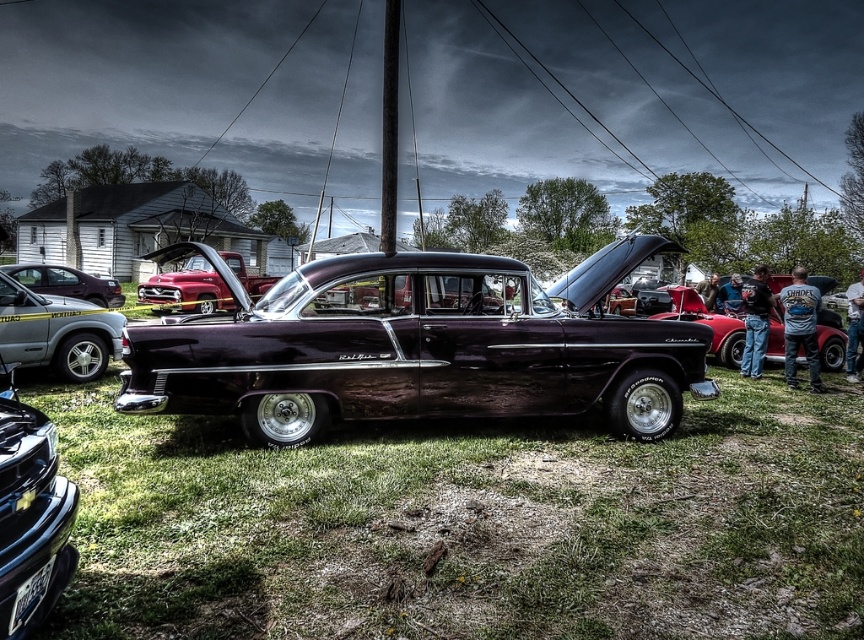
Between shiny dark purple car at center and shiny metallic car at left, which one appears on the right side from the viewer's perspective?

shiny dark purple car at center is more to the right.

Is point (379, 260) behind point (119, 294)?

No.

Measure the distance between shiny dark purple car at center and camera.

shiny dark purple car at center and camera are 17.42 feet apart from each other.

This screenshot has width=864, height=640. What are the coordinates of `shiny dark purple car at center` in the screenshot? It's located at (410, 353).

Does shiny dark purple car at center have a smaller size compared to metallic silver suv at left?

No.

Is point (404, 408) more distant than point (77, 305)?

No, it is in front of (77, 305).

Is point (516, 296) farther from viewer compared to point (30, 314)?

No, it is in front of (30, 314).

At what (x,y) coordinates should I click in order to perform the action: click on shiny dark purple car at center. Please return your answer as a coordinate pair (x, y). Looking at the image, I should click on (410, 353).

Can you confirm if green grass at center is positioned to the left of metallic silver suv at left?

Incorrect, green grass at center is not on the left side of metallic silver suv at left.

Is green grass at center shorter than metallic silver suv at left?

Yes, green grass at center is shorter than metallic silver suv at left.

Where is `green grass at center`? green grass at center is located at coordinates (467, 524).

Identify the location of green grass at center. (467, 524).